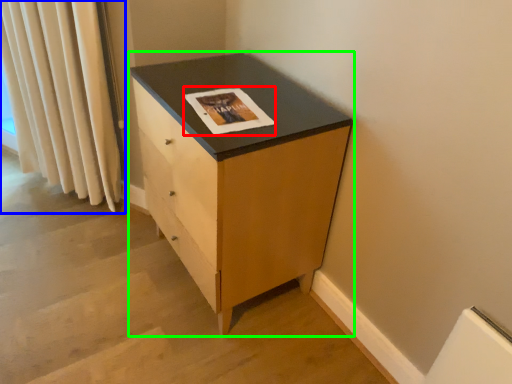
Question: Which object is the farthest from magazine (highlighted by a red box)? Choose among these: curtain (highlighted by a blue box) or chest of drawers (highlighted by a green box).

Choices:
 (A) curtain
 (B) chest of drawers

Answer: (A)